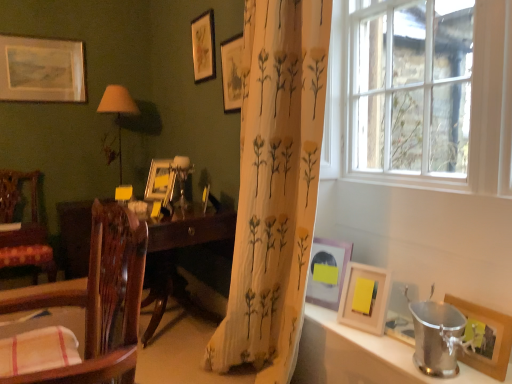
Question: Is the position of wooden chair at left, the 1th chair from the front, more distant than that of matte brown lampshade at left?

Choices:
 (A) no
 (B) yes

Answer: (A)

Question: From the image's perspective, would you say wooden chair at left, acting as the 2th chair starting from the left, is shown under matte brown lampshade at left?

Choices:
 (A) no
 (B) yes

Answer: (B)

Question: From the image's perspective, is wooden chair at left, the 1th chair from the front, on matte brown lampshade at left?

Choices:
 (A) no
 (B) yes

Answer: (A)

Question: Is wooden chair at left, arranged as the first chair when viewed from the right, shorter than matte brown lampshade at left?

Choices:
 (A) yes
 (B) no

Answer: (A)

Question: Considering the relative positions of wooden chair at left, arranged as the first chair when viewed from the right, and matte brown lampshade at left in the image provided, is wooden chair at left, arranged as the first chair when viewed from the right, to the left of matte brown lampshade at left from the viewer's perspective?

Choices:
 (A) no
 (B) yes

Answer: (A)

Question: In terms of height, does wooden picture frame at lower right, arranged as the sixth picture frame when viewed from the left, look taller or shorter compared to wooden picture frame at right, which is counted as the 7th picture frame, starting from the left?

Choices:
 (A) short
 (B) tall

Answer: (B)

Question: Looking at their shapes, would you say wooden picture frame at lower right, arranged as the sixth picture frame when viewed from the left, is wider or thinner than wooden picture frame at right, the first picture frame when ordered from front to back?

Choices:
 (A) thin
 (B) wide

Answer: (B)

Question: From a real-world perspective, is wooden picture frame at lower right, positioned as the second picture frame in front-to-back order, above or below wooden picture frame at right, marked as the seventh picture frame in a back-to-front arrangement?

Choices:
 (A) below
 (B) above

Answer: (B)

Question: Visually, is wooden picture frame at lower right, the 2th picture frame from the right, positioned to the left or to the right of wooden picture frame at right, which is counted as the 7th picture frame, starting from the left?

Choices:
 (A) right
 (B) left

Answer: (B)

Question: Based on their positions, is wooden desk at center located to the left or right of wooden chair at left, arranged as the first chair when viewed from the right?

Choices:
 (A) right
 (B) left

Answer: (B)

Question: Considering the positions of wooden desk at center and wooden chair at left, the 1th chair from the front, in the image, is wooden desk at center taller or shorter than wooden chair at left, the 1th chair from the front,?

Choices:
 (A) tall
 (B) short

Answer: (A)

Question: From a real-world perspective, is wooden desk at center above or below wooden chair at left, the 2th chair viewed from the back?

Choices:
 (A) above
 (B) below

Answer: (B)

Question: Is wooden desk at center spatially inside wooden chair at left, the 1th chair from the front, or outside of it?

Choices:
 (A) outside
 (B) inside

Answer: (A)

Question: From the image's perspective, relative to matte brown lampshade at left, is pink matte picture frame at lower right, which ranks as the 3th picture frame in front-to-back order, above or below?

Choices:
 (A) below
 (B) above

Answer: (A)

Question: Which is correct: pink matte picture frame at lower right, the 5th picture frame when ordered from left to right, is inside matte brown lampshade at left, or outside of it?

Choices:
 (A) outside
 (B) inside

Answer: (A)